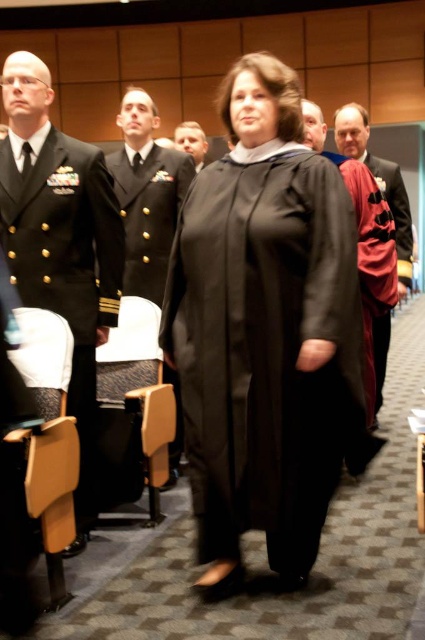
You are a photographer at the event and need to capture a clear photo of the shiny black uniform at center without the matte black uniform at center blocking it. How should you adjust your camera position?

Move the camera forward to focus on the shiny black uniform at center since it is in front of the matte black uniform at center, allowing it to be captured clearly without obstruction.

What is located at the coordinates point [363,241] in the image?

The velvet burgundy robe at center is located at point [363,241].